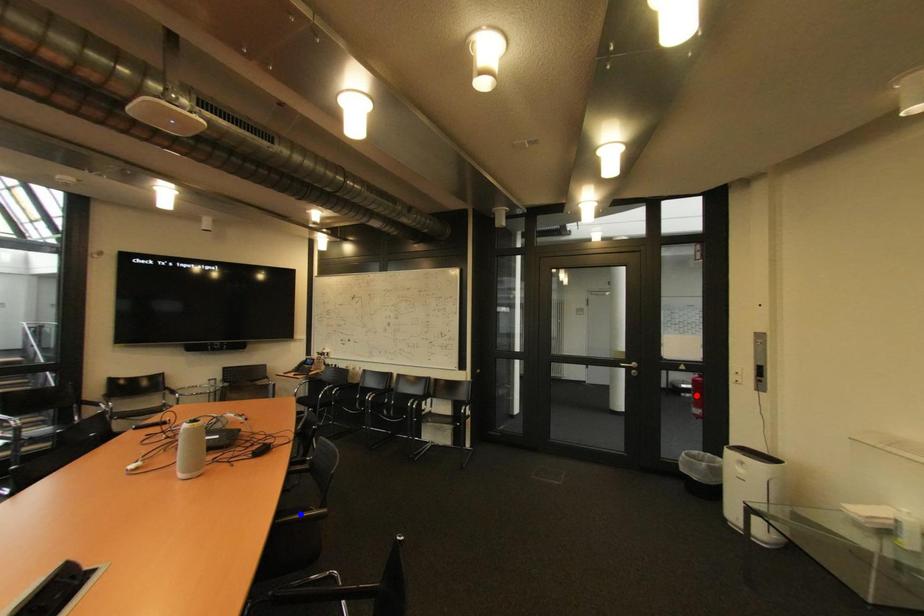
Question: Which of the two points in the image is closer to the camera?

Choices:
 (A) Blue point is closer.
 (B) Red point is closer.

Answer: (A)